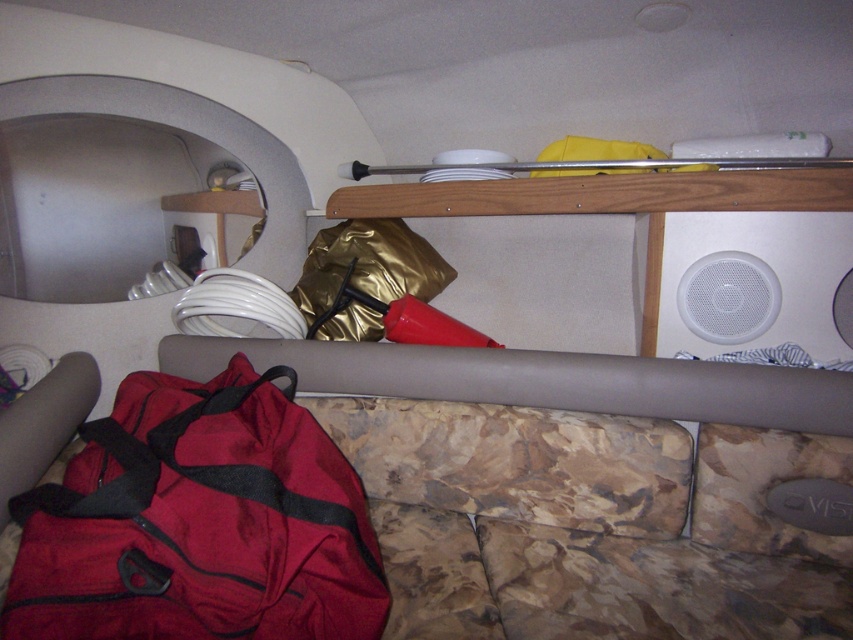
You are a delivery person who needs to place a new 40 inch long package in the RV. You see the red fabric duffel at lower left. Can you fit the package in the space where the red fabric duffel is currently located?

The red fabric duffel at lower left is 39.06 inches from camera. The package is 40 inches long, so it may not fit in that space as it is slightly longer than the available space.

You are organizing the items in the RV and need to place the red fabric duffel at lower left. Where exactly should you position it according to the coordinates provided?

The red fabric duffel at lower left should be positioned at coordinates point (x=589, y=524) as specified in the description.

You are organizing the RV and need to place a heavy tool box. Which object, the gray matte ledge at lower center or the wooden shelf at upper center, is positioned to the left side of the other and thus might be a better option for stability?

The gray matte ledge at lower center is to the left of the wooden shelf at upper center, so placing the heavy tool box on the wooden shelf at upper center might provide better stability as it is positioned to the right of the ledge.